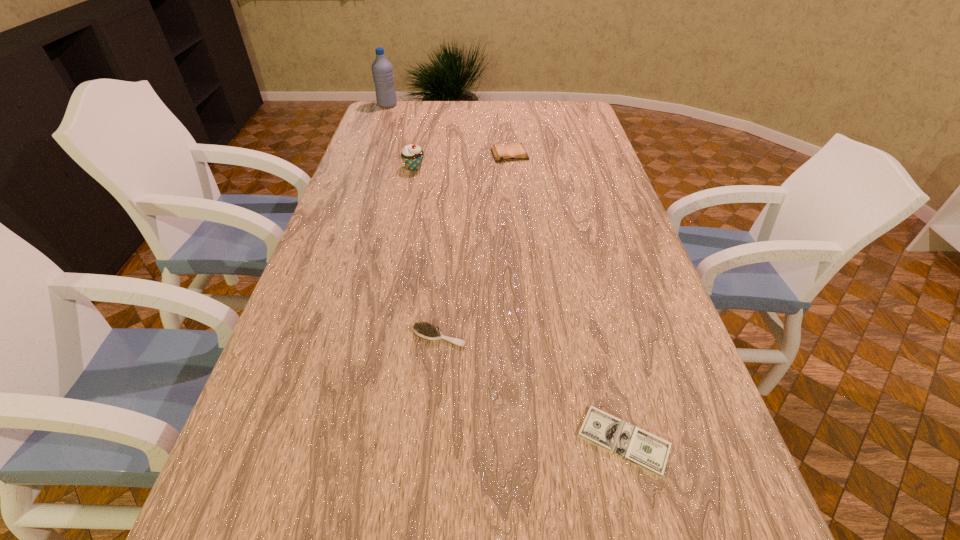
At what (x,y) coordinates should I click in order to perform the action: click on empty location between the cupcake and the fourth object from left to right. Please return your answer as a coordinate pair (x, y). The image size is (960, 540). Looking at the image, I should click on (462, 161).

I want to click on vacant space in between the water bottle and the nearest object, so click(506, 273).

You are a GUI agent. You are given a task and a screenshot of the screen. Output one action in this format:
    pyautogui.click(x=<x>, y=<y>)
    Task: Click on the object that is the second closest one to the rightmost object
    The image size is (960, 540).
    Given the screenshot: What is the action you would take?
    pyautogui.click(x=515, y=151)

At what (x,y) coordinates should I click in order to perform the action: click on the fourth closest object to the nearest object. Please return your answer as a coordinate pair (x, y). The width and height of the screenshot is (960, 540). Looking at the image, I should click on (382, 70).

Locate an element on the screen. vacant space that satisfies the following two spatial constraints: 1. on the front side of the leftmost object; 2. on the right side of the nearest object is located at coordinates (266, 441).

The height and width of the screenshot is (540, 960). I want to click on free spot that satisfies the following two spatial constraints: 1. on the front side of the fourth object from right to left; 2. on the right side of the third object from right to left, so click(378, 337).

Where is `blank space that satisfies the following two spatial constraints: 1. on the front side of the second tallest object; 2. on the left side of the tallest object`? This screenshot has width=960, height=540. blank space that satisfies the following two spatial constraints: 1. on the front side of the second tallest object; 2. on the left side of the tallest object is located at coordinates (365, 168).

The height and width of the screenshot is (540, 960). I want to click on free space in the image that satisfies the following two spatial constraints: 1. on the front side of the dollar; 2. on the left side of the diary, so click(x=538, y=441).